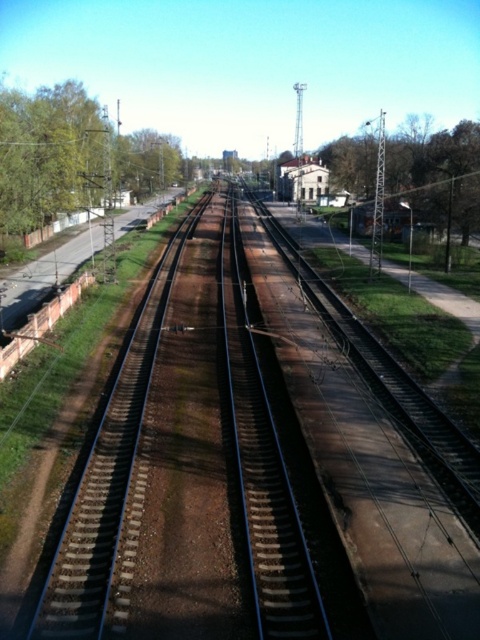
Does green leafy tree at left have a smaller size compared to green leafy tree at center?

Yes, green leafy tree at left is smaller than green leafy tree at center.

Where is `green leafy tree at left`? Image resolution: width=480 pixels, height=640 pixels. green leafy tree at left is located at coordinates (48, 156).